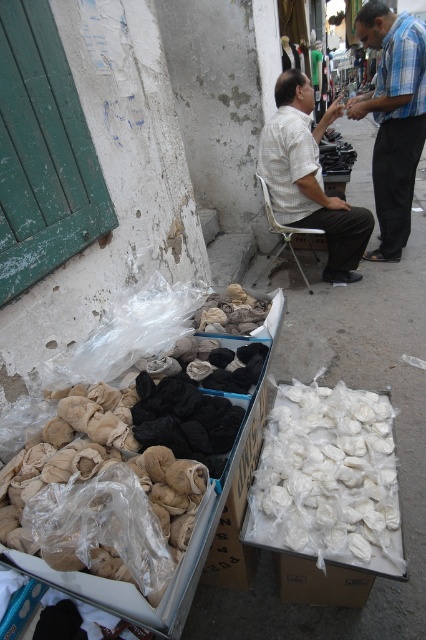
Question: Does blue plaid shirt at upper right have a greater width compared to beige fabric at center?

Choices:
 (A) yes
 (B) no

Answer: (A)

Question: Can you confirm if beige fabric at center is positioned below metallic silver chair at center?

Choices:
 (A) yes
 (B) no

Answer: (A)

Question: Which object is the farthest from the blue plaid shirt at upper right?

Choices:
 (A) metallic silver chair at center
 (B) white matte food at center
 (C) white textured shirt at center
 (D) beige fabric at center

Answer: (B)

Question: Which point is closer to the camera taking this photo?

Choices:
 (A) (425, 132)
 (B) (250, 330)
 (C) (307, 83)

Answer: (B)

Question: Does beige fabric at center appear under metallic silver chair at center?

Choices:
 (A) no
 (B) yes

Answer: (B)

Question: Based on their relative distances, which object is farther from the blue plaid shirt at upper right?

Choices:
 (A) white textured shirt at center
 (B) beige fabric at center
 (C) white matte food at center

Answer: (C)